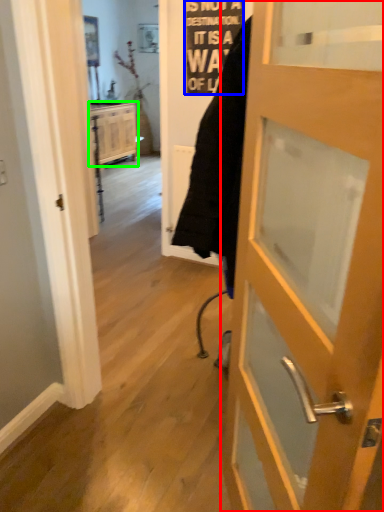
Question: Considering the real-world distances, which object is farthest from door (highlighted by a red box)? writing (highlighted by a blue box) or cabinetry (highlighted by a green box)?

Choices:
 (A) writing
 (B) cabinetry

Answer: (B)